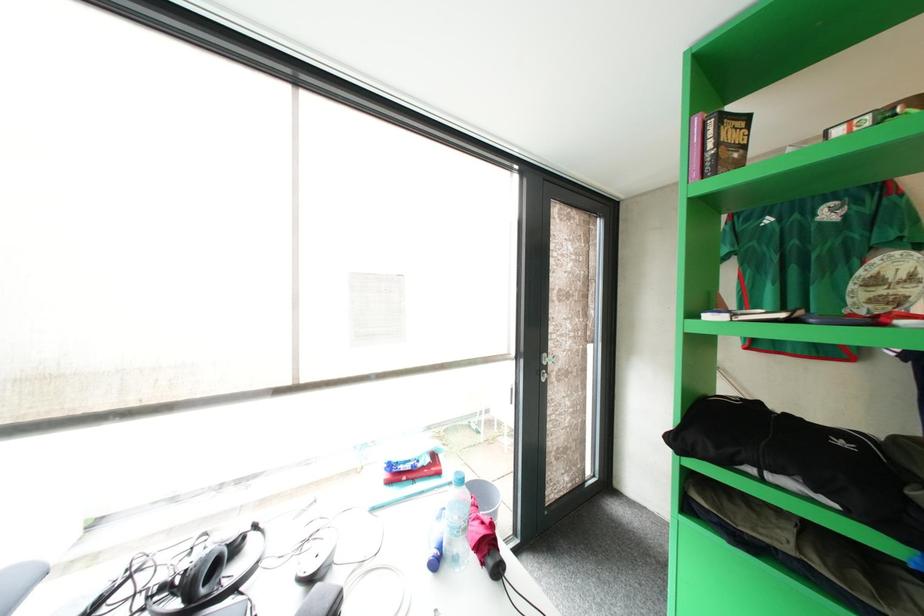
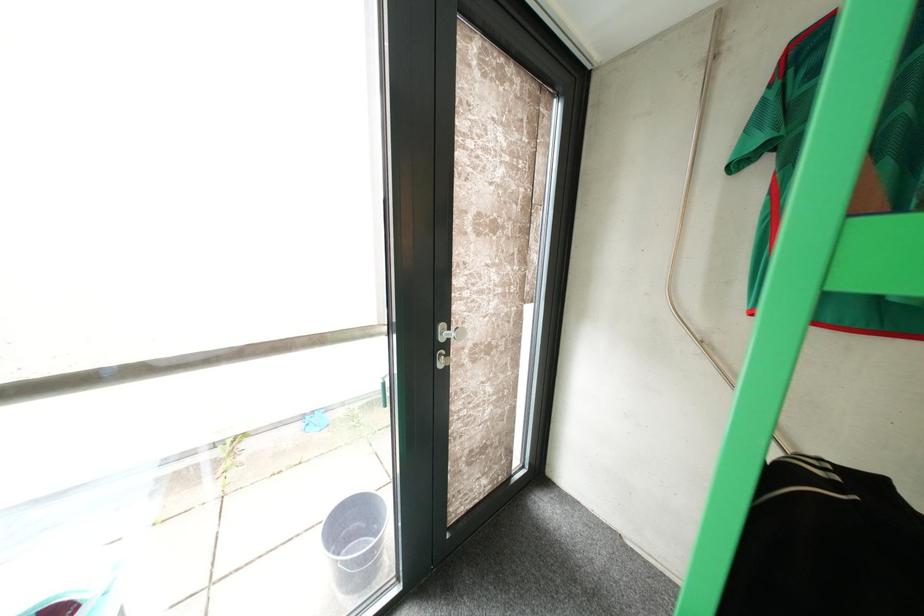
Which direction would the cameraman need to move to produce the second image?

The movement direction of the cameraman is right, forward.